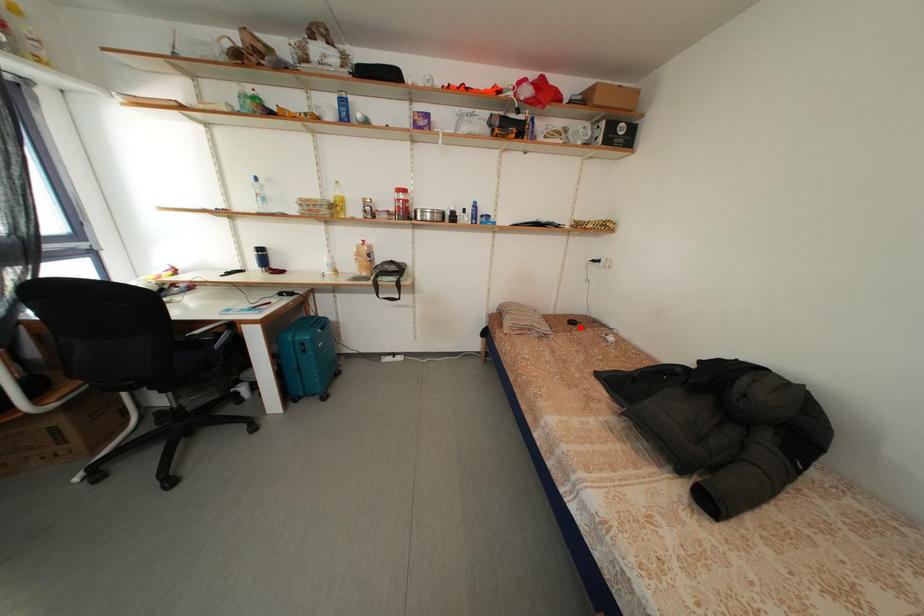
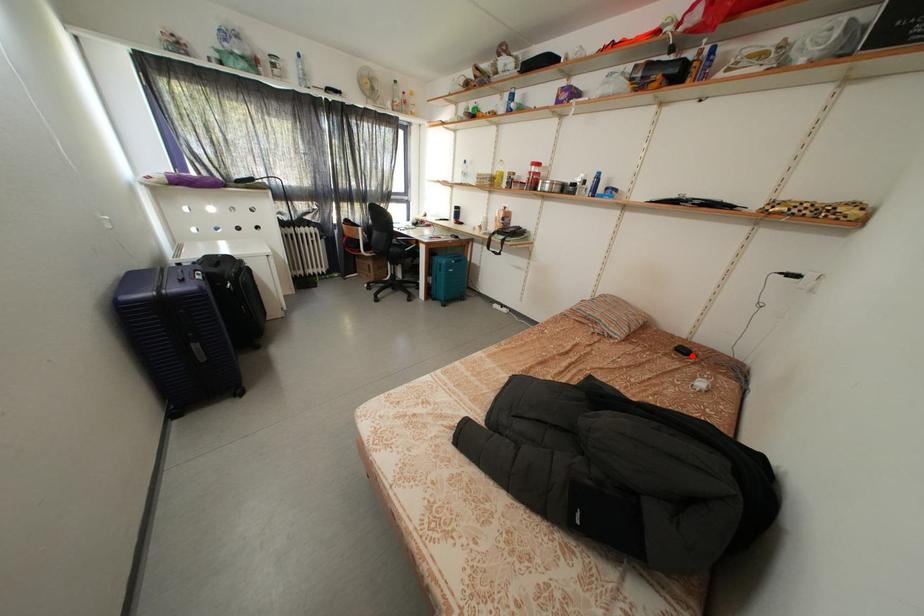
In the scene shown: I am providing you with two images of the same scene from different viewpoints. A red point is marked on the first image and another point is marked on the second image. Are the points marked in image1 and image2 representing the same 3D position?

Yes